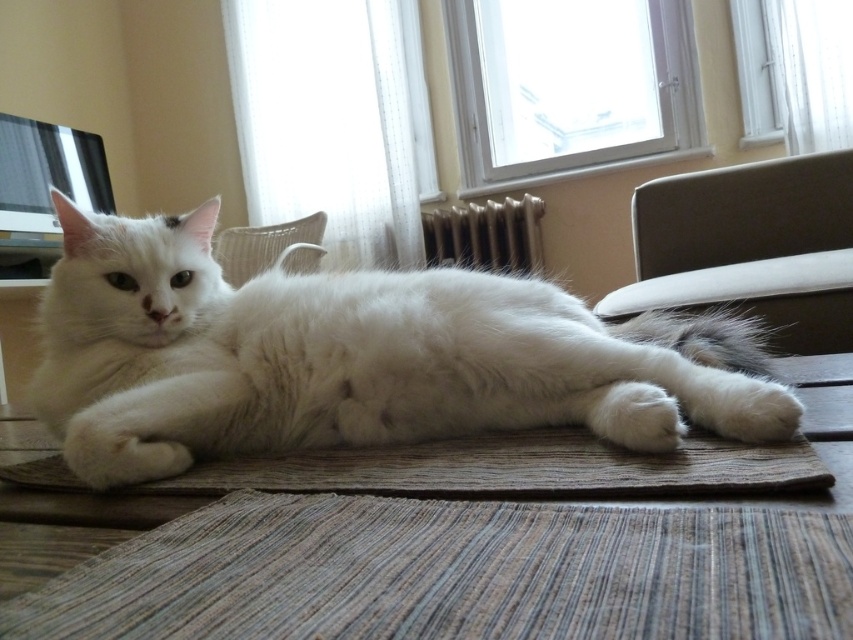
Question: Which of these objects is positioned farthest from the metallic silver radiator at center?

Choices:
 (A) brown woven mat at center
 (B) brown leather chair at upper right
 (C) white fabric chair at upper center
 (D) white fluffy cat at center

Answer: (A)

Question: Does natural woven mat at center have a lesser width compared to white fabric chair at upper center?

Choices:
 (A) yes
 (B) no

Answer: (B)

Question: In this image, where is white fluffy cat at center located relative to brown woven mat at center?

Choices:
 (A) below
 (B) above

Answer: (B)

Question: Among these points, which one is nearest to the camera?

Choices:
 (A) (282, 248)
 (B) (521, 454)
 (C) (424, 216)

Answer: (B)

Question: Which point is farther to the camera?

Choices:
 (A) 369,294
 (B) 532,268
 (C) 244,244
 (D) 442,442

Answer: (B)

Question: Can you confirm if brown leather chair at upper right is positioned above white fabric chair at upper center?

Choices:
 (A) no
 (B) yes

Answer: (A)